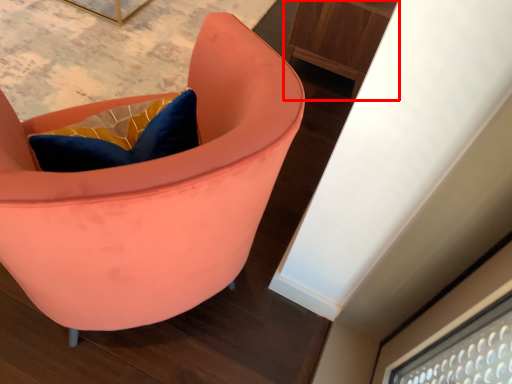
Question: Considering the relative positions of furniture (annotated by the red box) and chair in the image provided, where is furniture (annotated by the red box) located with respect to the staircase?

Choices:
 (A) right
 (B) left

Answer: (A)